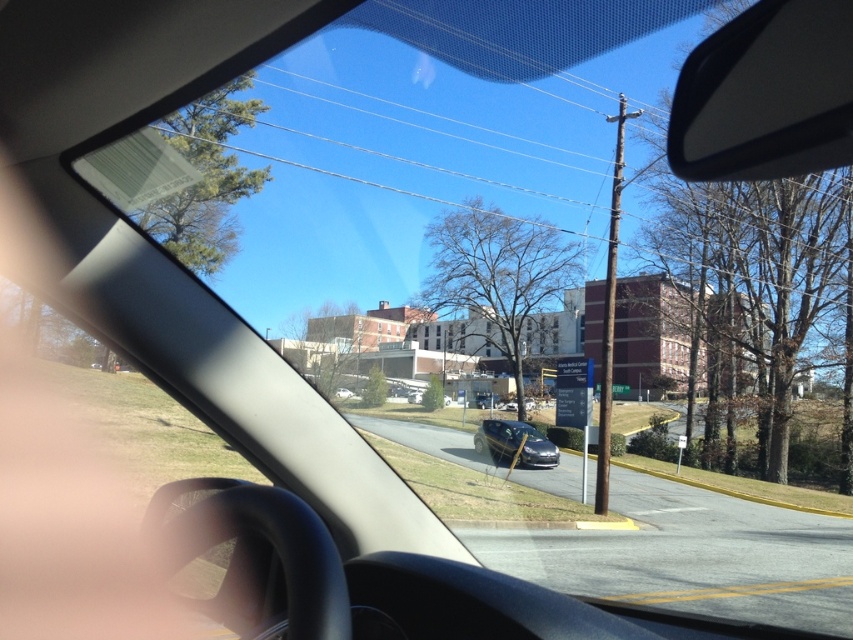
You are driving a car and want to check your blind spot. You notice the black plastic view mirror at upper right. Where is this mirror located relative to your current position?

The black plastic view mirror at upper right is located at point (766, 93) relative to your current position.

Based on the photo, you are a driver checking your surroundings before making a turn. You notice the black plastic view mirror at upper right and the satin black sedan at center. Which object is narrower in width?

The black plastic view mirror at upper right is narrower in width compared to the satin black sedan at center according to the description.

You are sitting in the driver seat of the car and want to check your blind spot before changing lanes. You notice a point at coordinate (x=766, y=93) on the windshield. Is this point located on the black plastic view mirror at upper right?

Yes, the point (x=766, y=93) is on the black plastic view mirror at upper right according to the description.